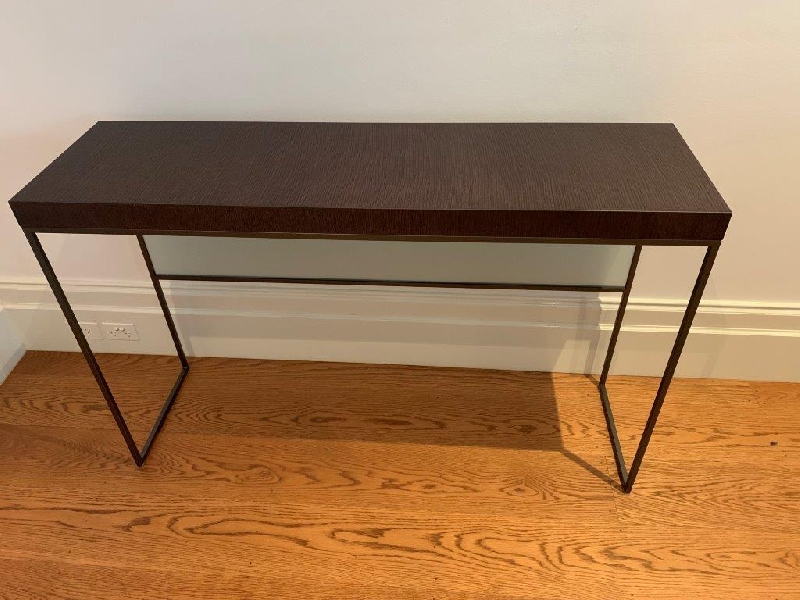
Locate an element on the screen. This screenshot has height=600, width=800. dark part of wooden floor is located at coordinates [530, 429].